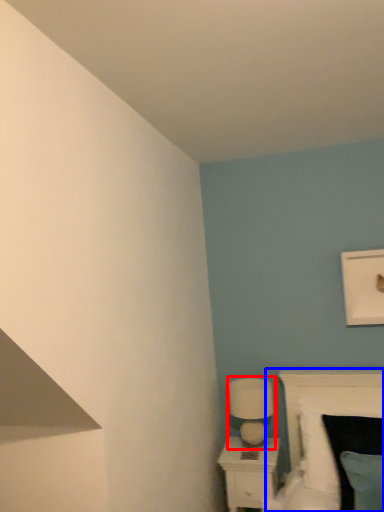
Question: Which object is further to the camera taking this photo, table lamp (highlighted by a red box) or bed (highlighted by a blue box)?

Choices:
 (A) table lamp
 (B) bed

Answer: (A)